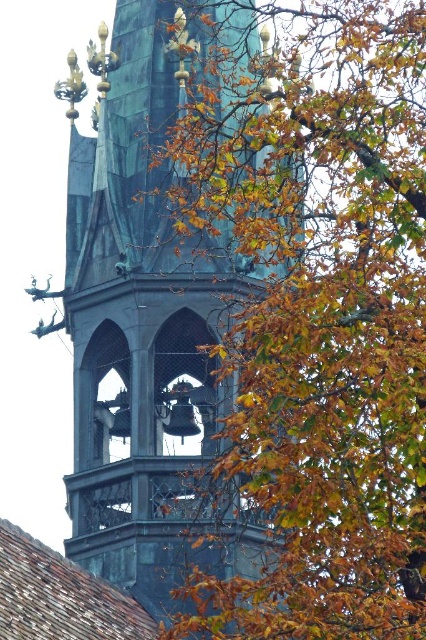
Question: Among these points, which one is nearest to the camera?

Choices:
 (A) (187, 509)
 (B) (308, 570)

Answer: (B)

Question: Does autumn leaves at upper right have a greater width compared to green patina tower at center?

Choices:
 (A) yes
 (B) no

Answer: (A)

Question: Is autumn leaves at upper right to the right of green patina tower at center from the viewer's perspective?

Choices:
 (A) yes
 (B) no

Answer: (A)

Question: Which object appears farthest from the camera in this image?

Choices:
 (A) autumn leaves at upper right
 (B) green patina tower at center

Answer: (B)

Question: Which point is closer to the camera?

Choices:
 (A) (221, 486)
 (B) (83, 442)

Answer: (A)

Question: Does autumn leaves at upper right have a larger size compared to green patina tower at center?

Choices:
 (A) yes
 (B) no

Answer: (A)